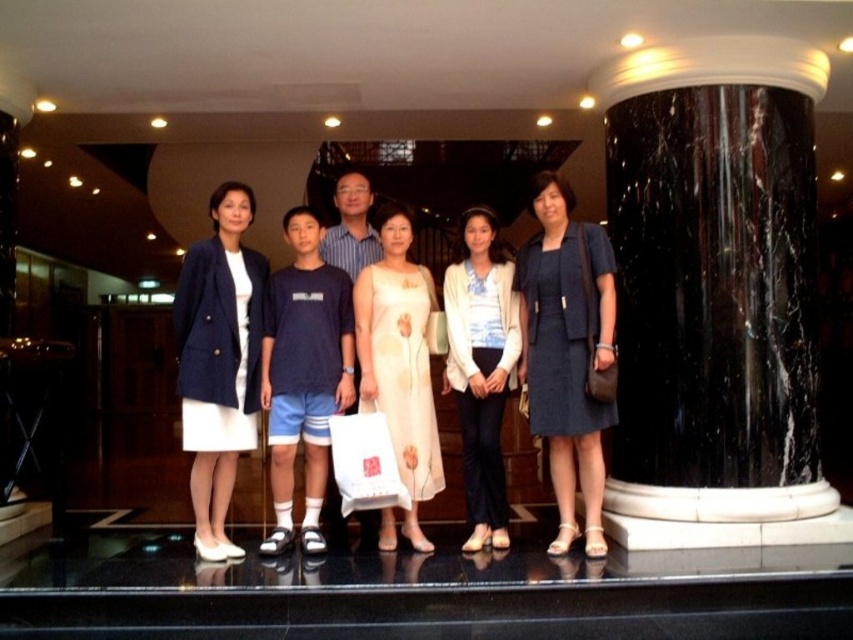
Question: Can you confirm if matte blue dress at center is thinner than light beige floral dress at center?

Choices:
 (A) yes
 (B) no

Answer: (B)

Question: Which of the following is the closest to the observer?

Choices:
 (A) light beige floral dress at center
 (B) white textured blazer at center
 (C) matte blue dress at center
 (D) black marble pillar at right

Answer: (C)

Question: Based on their relative distances, which object is nearer to the white textured blazer at center?

Choices:
 (A) navy blue fabric skirt at center
 (B) black marble pillar at right
 (C) light beige floral dress at center

Answer: (C)

Question: Is matte blue dress at center positioned at the back of white textured blazer at center?

Choices:
 (A) yes
 (B) no

Answer: (B)

Question: Which of the following is the closest to the observer?

Choices:
 (A) light beige floral dress at center
 (B) white textured blazer at center
 (C) black marble pillar at right
 (D) navy blue fabric skirt at center

Answer: (D)

Question: From the image, what is the correct spatial relationship of black marble pillar at right in relation to navy blue fabric skirt at center?

Choices:
 (A) left
 (B) right

Answer: (B)